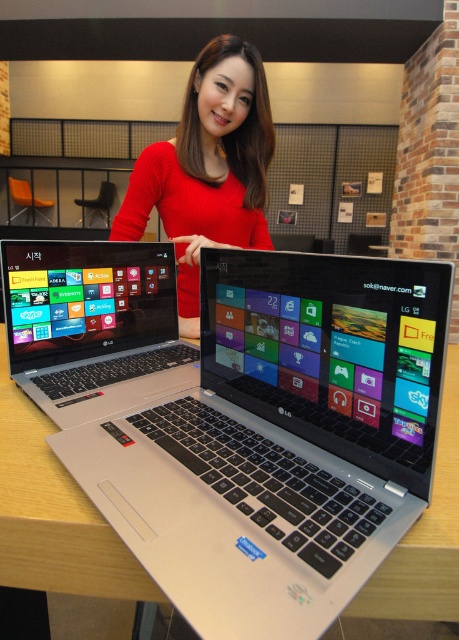
Does wooden table at center appear on the right side of silver metallic laptop at center?

Indeed, wooden table at center is positioned on the right side of silver metallic laptop at center.

Who is more forward, (70, 538) or (82, 291)?

Positioned in front is point (70, 538).

Is point (98, 572) more distant than point (168, 339)?

No, (98, 572) is in front of (168, 339).

Locate an element on the screen. wooden table at center is located at coordinates (54, 515).

Can you confirm if silver metallic laptop at center is positioned to the left of matte red sweater at center?

Correct, you'll find silver metallic laptop at center to the left of matte red sweater at center.

Is point (160, 355) behind point (190, 150)?

No, it is not.

The height and width of the screenshot is (640, 459). What do you see at coordinates (94, 326) in the screenshot?
I see `silver metallic laptop at center` at bounding box center [94, 326].

At what (x,y) coordinates should I click in order to perform the action: click on silver metallic laptop at center. Please return your answer as a coordinate pair (x, y). The height and width of the screenshot is (640, 459). Looking at the image, I should click on (94, 326).

Which is more to the left, wooden table at center or matte red sweater at center?

From the viewer's perspective, matte red sweater at center appears more on the left side.

Which of these two, wooden table at center or matte red sweater at center, stands taller?

matte red sweater at center

Locate an element on the screen. wooden table at center is located at coordinates (54, 515).

What are the coordinates of `wooden table at center` in the screenshot? It's located at (54, 515).